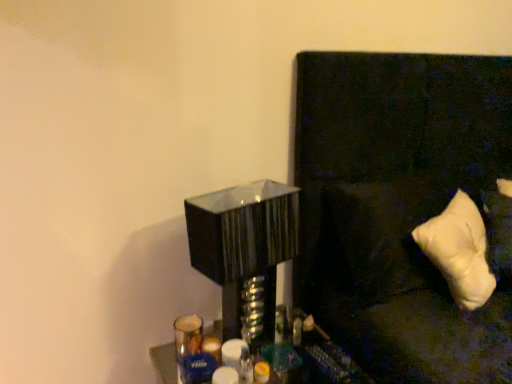
Question: From the image's perspective, does glossy black table lamp at center appear lower than white soft pillow at right?

Choices:
 (A) yes
 (B) no

Answer: (A)

Question: Is glossy black table lamp at center outside of white soft pillow at right?

Choices:
 (A) yes
 (B) no

Answer: (A)

Question: Considering the relative sizes of glossy black table lamp at center and white soft pillow at right in the image provided, is glossy black table lamp at center shorter than white soft pillow at right?

Choices:
 (A) no
 (B) yes

Answer: (B)

Question: Can you confirm if glossy black table lamp at center is wider than white soft pillow at right?

Choices:
 (A) yes
 (B) no

Answer: (B)

Question: Is glossy black table lamp at center not close to white soft pillow at right?

Choices:
 (A) no
 (B) yes

Answer: (A)

Question: Considering the relative positions of white soft pillow at right and metallic silver tray at lower center in the image provided, is white soft pillow at right to the left or to the right of metallic silver tray at lower center?

Choices:
 (A) right
 (B) left

Answer: (A)

Question: Considering the positions of white soft pillow at right and metallic silver tray at lower center in the image, is white soft pillow at right taller or shorter than metallic silver tray at lower center?

Choices:
 (A) tall
 (B) short

Answer: (B)

Question: Considering the positions of white soft pillow at right and metallic silver tray at lower center in the image, is white soft pillow at right wider or thinner than metallic silver tray at lower center?

Choices:
 (A) thin
 (B) wide

Answer: (A)

Question: Is white soft pillow at right bigger or smaller than metallic silver tray at lower center?

Choices:
 (A) big
 (B) small

Answer: (B)

Question: From a real-world perspective, is glossy black table lamp at center physically located above or below white soft pillow at right?

Choices:
 (A) above
 (B) below

Answer: (B)

Question: Is point [x=272, y=297] closer or farther from the camera than point [x=486, y=283]?

Choices:
 (A) farther
 (B) closer

Answer: (A)

Question: Is glossy black table lamp at center inside the boundaries of white soft pillow at right, or outside?

Choices:
 (A) outside
 (B) inside

Answer: (A)

Question: In terms of width, does glossy black table lamp at center look wider or thinner when compared to white soft pillow at right?

Choices:
 (A) wide
 (B) thin

Answer: (B)

Question: Is white soft pillow at right wider or thinner than glossy black table lamp at center?

Choices:
 (A) thin
 (B) wide

Answer: (B)

Question: Which is correct: white soft pillow at right is inside glossy black table lamp at center, or outside of it?

Choices:
 (A) inside
 (B) outside

Answer: (B)